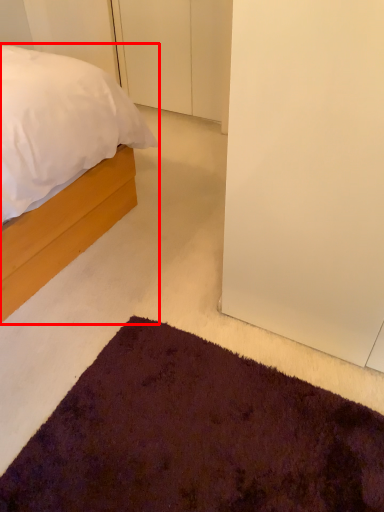
Question: From the image's perspective, where is bed (annotated by the red box) located in relation to door in the image?

Choices:
 (A) below
 (B) above

Answer: (A)